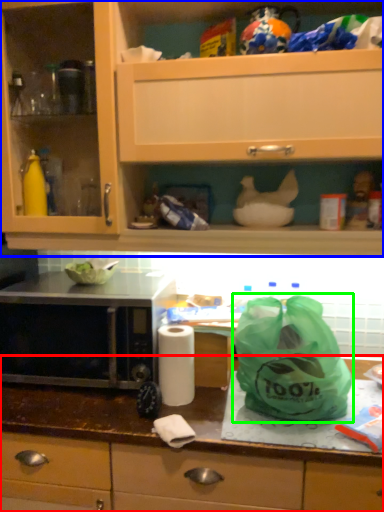
Question: Which object is positioned farthest from countertop (highlighted by a red box)? Select from cabinetry (highlighted by a blue box) and plastic bag (highlighted by a green box).

Choices:
 (A) cabinetry
 (B) plastic bag

Answer: (A)